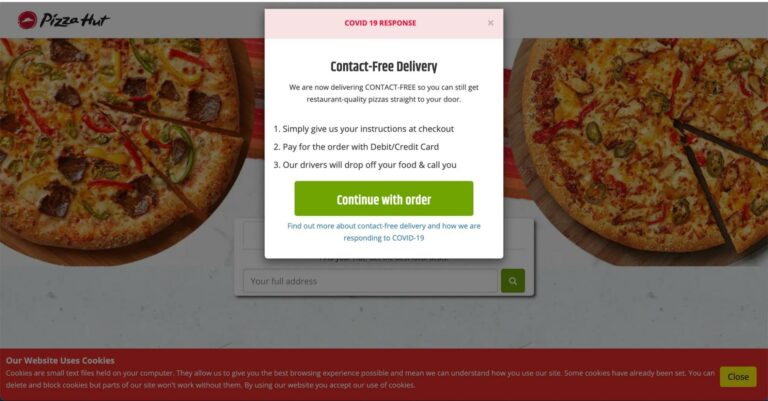
Where is `wooden pizza paddle`? This screenshot has height=401, width=768. wooden pizza paddle is located at coordinates (576, 242).